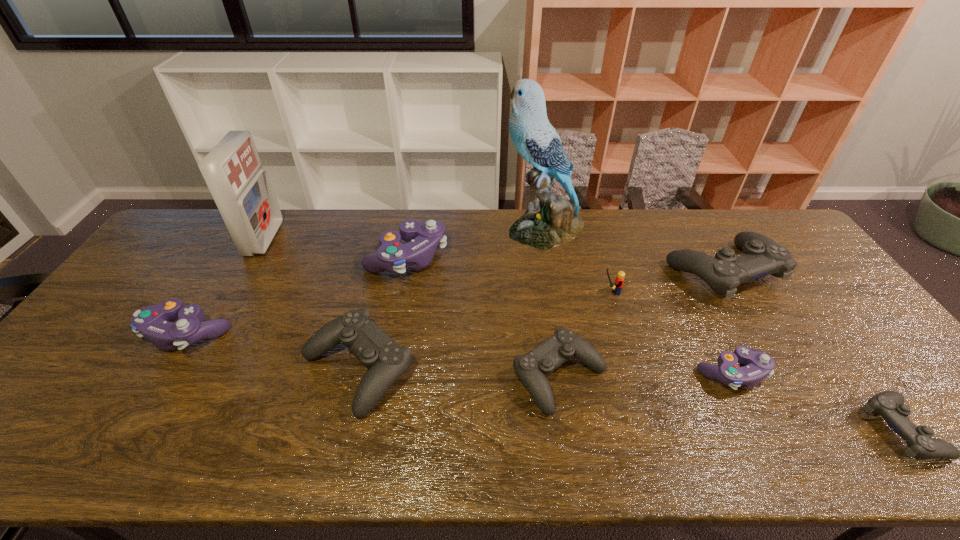
Identify the location of parakeet. The width and height of the screenshot is (960, 540). (551, 220).

Where is `red first-aid kit`? red first-aid kit is located at coordinates (232, 170).

At what (x,y) coordinates should I click in order to perform the action: click on the first-aid kit. Please return your answer as a coordinate pair (x, y). Looking at the image, I should click on (232, 170).

Find the location of a particular element. The height and width of the screenshot is (540, 960). the farthest purple control is located at coordinates (423, 238).

Locate an element on the screen. This screenshot has width=960, height=540. the second purple control from left to right is located at coordinates (423, 238).

At what (x,y) coordinates should I click in order to perform the action: click on the farthest gray control. Please return your answer as a coordinate pair (x, y). The image size is (960, 540). Looking at the image, I should click on (762, 256).

The height and width of the screenshot is (540, 960). In order to click on Lego in this screenshot , I will do `click(619, 280)`.

Identify the location of the leftmost purple control. (152, 322).

Find the location of `the leftmost control`. the leftmost control is located at coordinates (152, 322).

In order to click on the second biggest gray control in this screenshot , I will do `click(387, 361)`.